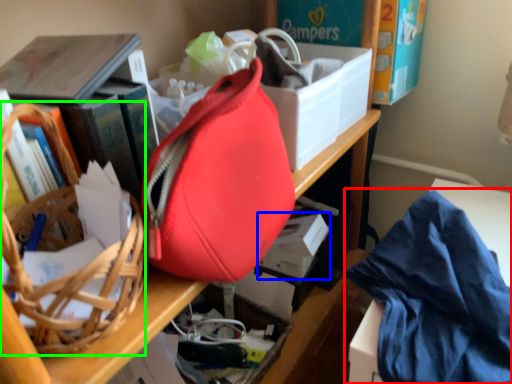
Question: Considering the real-world distances, which object is closest to clothe (highlighted by a red box)? storage box (highlighted by a blue box) or basket (highlighted by a green box).

Choices:
 (A) storage box
 (B) basket

Answer: (A)